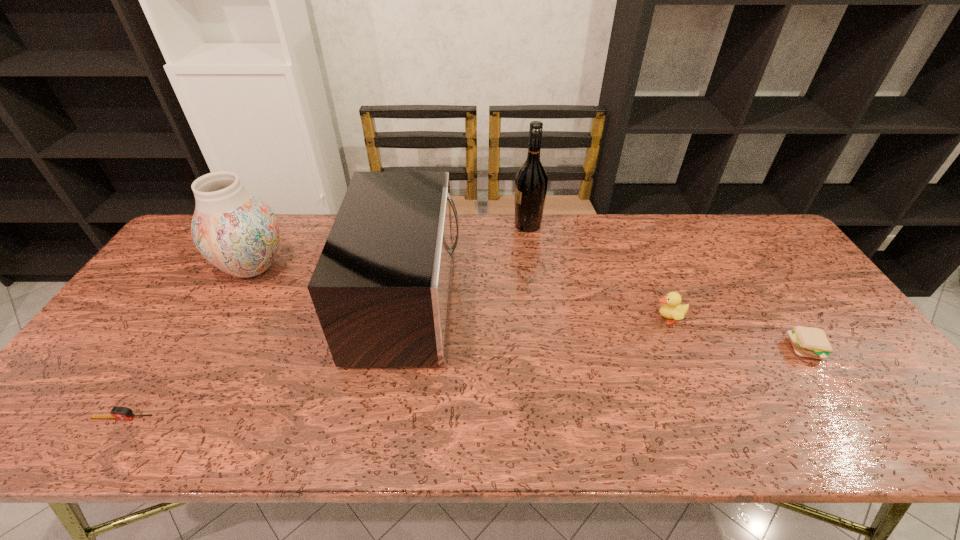
Identify the location of vacant area that lies between the rightmost object and the farthest object. This screenshot has height=540, width=960. (667, 287).

The height and width of the screenshot is (540, 960). Find the location of `the fifth closest object to the fourth object from right to left`. the fifth closest object to the fourth object from right to left is located at coordinates (810, 342).

Locate which object is the third closest to the duckling. Please provide its 2D coordinates. Your answer should be formatted as a tuple, i.e. [(x, y)], where the tuple contains the x and y coordinates of a point satisfying the conditions above.

[(381, 288)]

You are a GUI agent. You are given a task and a screenshot of the screen. Output one action in this format:
    pyautogui.click(x=<x>, y=<y>)
    Task: Click on the vacant space that satisfies the following two spatial constraints: 1. with the door open on the fourth object from right to left; 2. on the back side of the second shortest object
    The width and height of the screenshot is (960, 540).
    Given the screenshot: What is the action you would take?
    [399, 349]

Image resolution: width=960 pixels, height=540 pixels. Find the location of `free spot that satisfies the following two spatial constraints: 1. with the door open on the fourth object from right to left; 2. on the right side of the second shortest object`. free spot that satisfies the following two spatial constraints: 1. with the door open on the fourth object from right to left; 2. on the right side of the second shortest object is located at coordinates (399, 349).

Where is `vacant point that satisfies the following two spatial constraints: 1. on the front-facing side of the third shortest object; 2. on the right side of the rightmost object`? vacant point that satisfies the following two spatial constraints: 1. on the front-facing side of the third shortest object; 2. on the right side of the rightmost object is located at coordinates (681, 349).

Locate an element on the screen. free location that satisfies the following two spatial constraints: 1. on the label of the farthest object; 2. on the back side of the patty is located at coordinates (544, 349).

Locate an element on the screen. Image resolution: width=960 pixels, height=540 pixels. blank area in the image that satisfies the following two spatial constraints: 1. with the door open on the rightmost object; 2. on the left side of the microwave oven is located at coordinates (399, 349).

Identify the location of vacant space that satisfies the following two spatial constraints: 1. with the door open on the microwave oven; 2. on the left side of the fifth tallest object. (399, 349).

Locate an element on the screen. This screenshot has width=960, height=540. blank area in the image that satisfies the following two spatial constraints: 1. on the front-facing side of the fifth tallest object; 2. on the right side of the third shortest object is located at coordinates (681, 349).